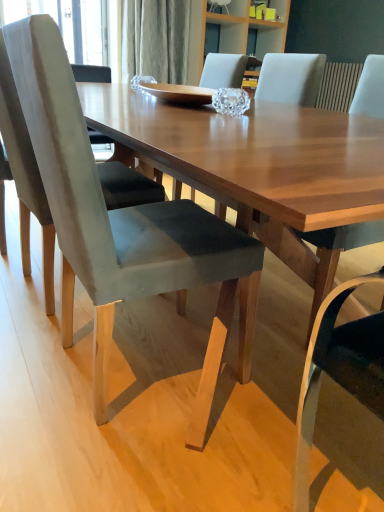
Find the location of a particular element. free space in front of velvet gray chair at center, positioned as the 2th chair in left-to-right order is located at coordinates (125, 469).